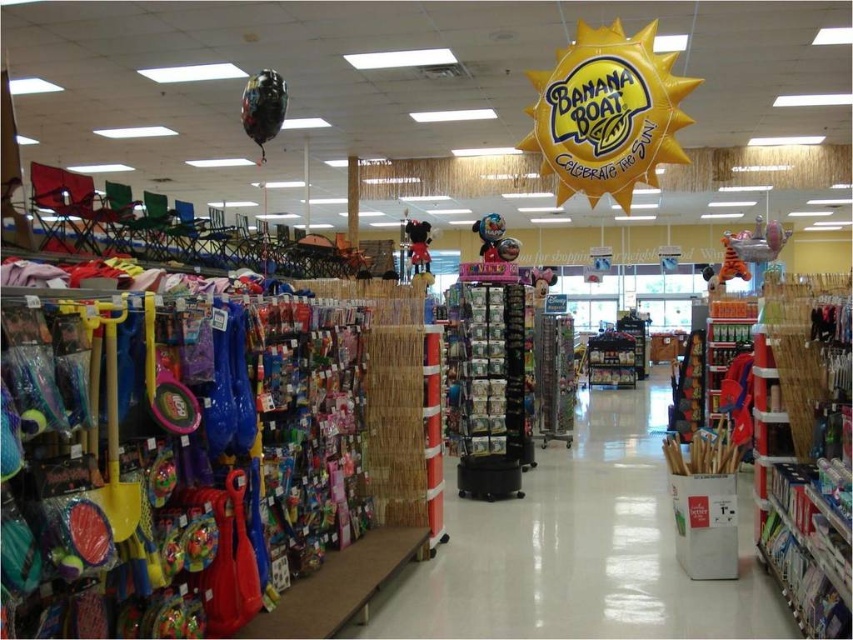
Question: Can you confirm if shiny metallic helmet at center is positioned below matte pink plush toy at center?

Choices:
 (A) yes
 (B) no

Answer: (A)

Question: Which of the following is the farthest from the observer?

Choices:
 (A) wooden sticks at center
 (B) plush red mickey mouse at center
 (C) shiny metallic helmet at center

Answer: (B)

Question: Does shiny metallic helmet at center lie behind matte pink plush toy at center?

Choices:
 (A) no
 (B) yes

Answer: (A)

Question: Which point is farther from the camera taking this photo?

Choices:
 (A) (540, 296)
 (B) (416, 252)
 (C) (480, 256)
 (D) (618, 580)

Answer: (A)

Question: Considering the real-world distances, which object is closest to the matte pink plush toy at center?

Choices:
 (A) plush red mickey mouse at center
 (B) wooden sticks at center

Answer: (A)

Question: Is wooden sticks at center to the left of plush red mickey mouse at center from the viewer's perspective?

Choices:
 (A) yes
 (B) no

Answer: (B)